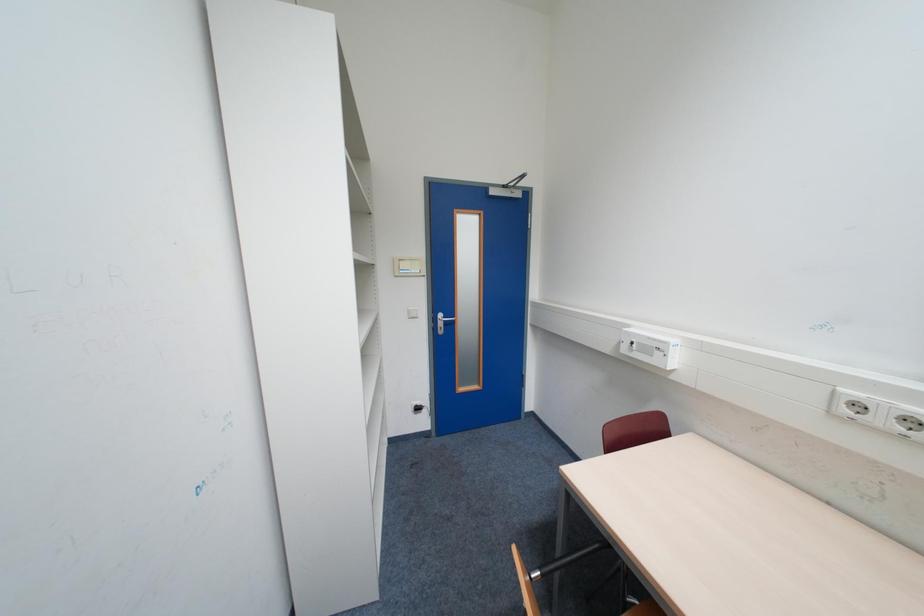
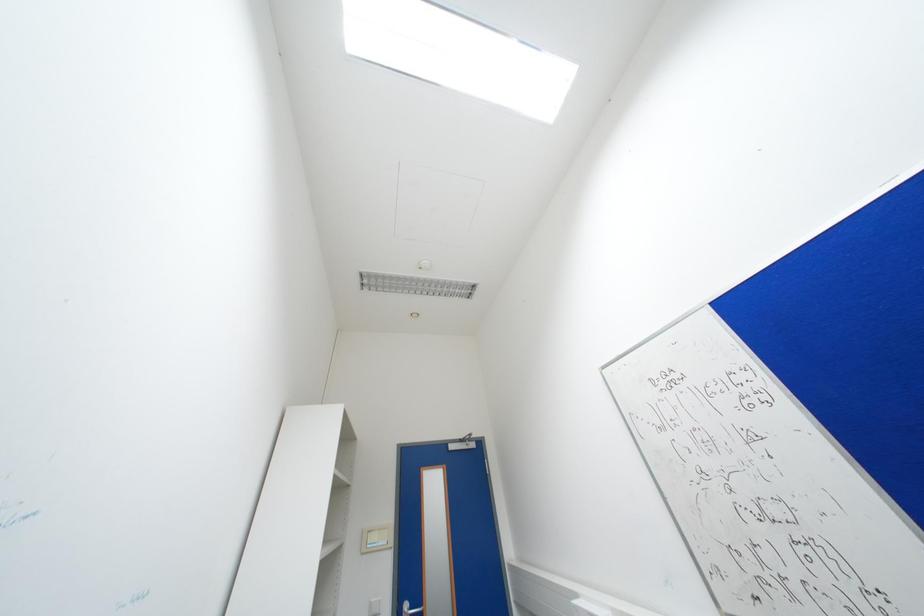
Question: How did the camera likely rotate?

Choices:
 (A) Left
 (B) Right
 (C) Up
 (D) Down

Answer: (C)